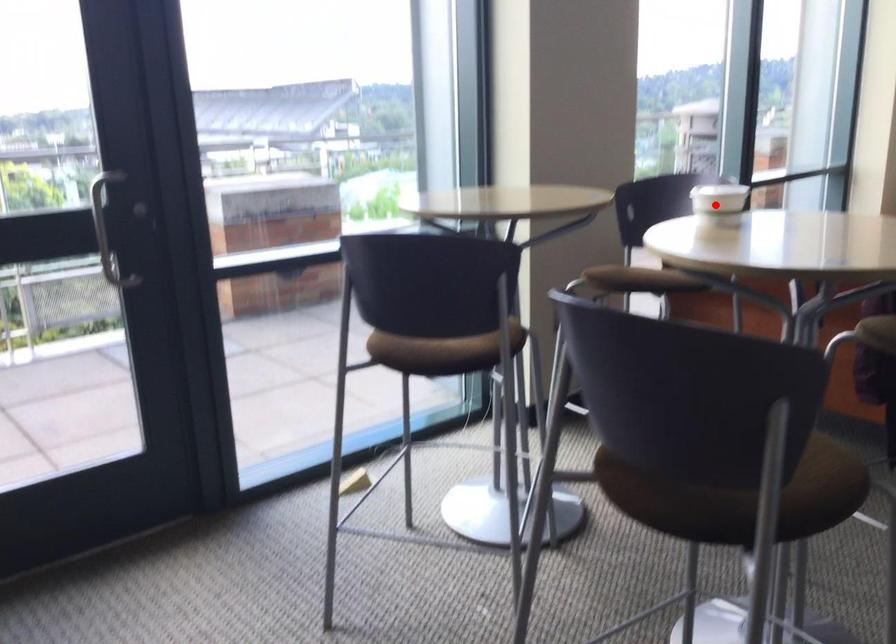
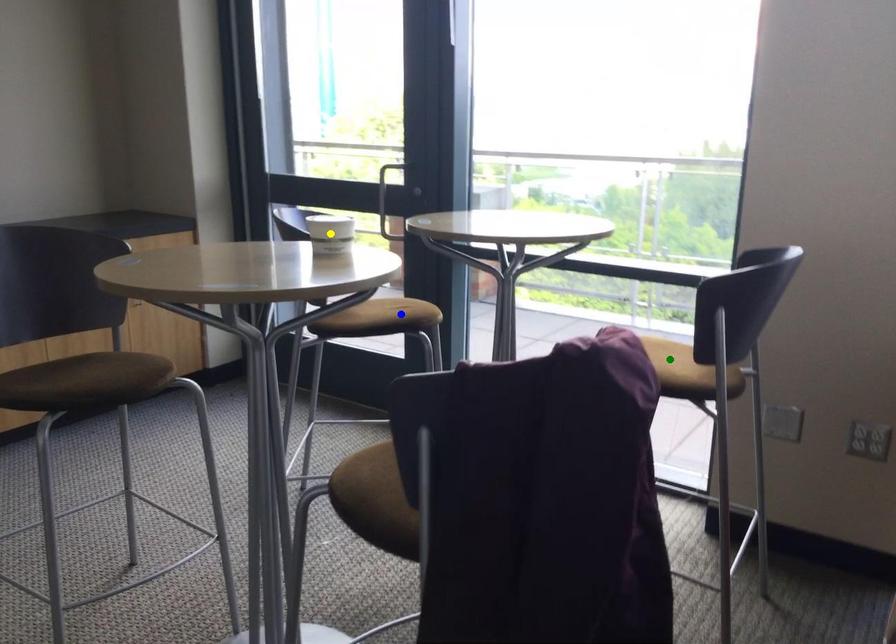
Question: I am providing you with two images of the same scene from different viewpoints. A red point is marked on the first image. You are given multiple points on the second image. Which spot in image 2 lines up with the point in image 1?

Choices:
 (A) yellow point
 (B) blue point
 (C) green point

Answer: (A)